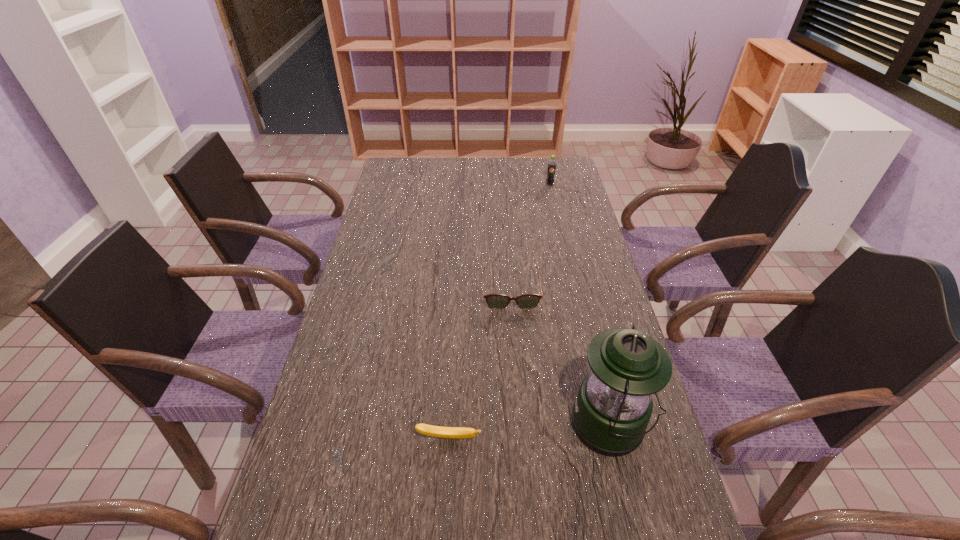
Where is `free region that satisfies the following two spatial constraints: 1. on the front label of the third shortest object; 2. on the left side of the tallest object`? free region that satisfies the following two spatial constraints: 1. on the front label of the third shortest object; 2. on the left side of the tallest object is located at coordinates (605, 426).

I want to click on free space that satisfies the following two spatial constraints: 1. on the front label of the lantern; 2. on the left side of the farthest object, so click(605, 426).

The height and width of the screenshot is (540, 960). I want to click on free point that satisfies the following two spatial constraints: 1. on the front label of the lantern; 2. on the right side of the second tallest object, so click(605, 426).

This screenshot has width=960, height=540. I want to click on free spot that satisfies the following two spatial constraints: 1. on the front label of the tallest object; 2. on the right side of the soda, so click(x=605, y=426).

Locate an element on the screen. The width and height of the screenshot is (960, 540). blank space that satisfies the following two spatial constraints: 1. at the front view of the lantern; 2. on the left side of the third object from right to left is located at coordinates (521, 426).